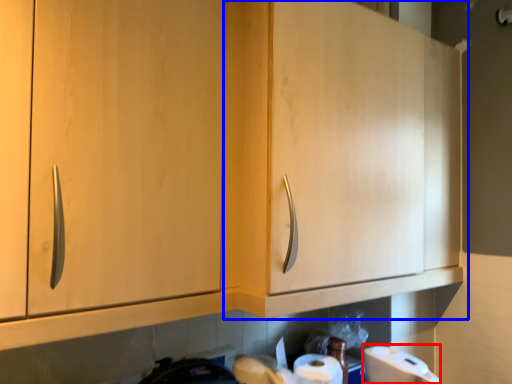
Question: Which of the following is the farthest to the observer, toilet paper (highlighted by a red box) or cabinetry (highlighted by a blue box)?

Choices:
 (A) toilet paper
 (B) cabinetry

Answer: (A)